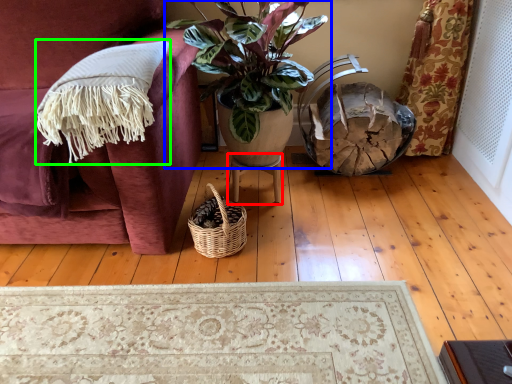
Question: Which is nearer to the table (highlighted by a red box)? houseplant (highlighted by a blue box) or blanket (highlighted by a green box).

Choices:
 (A) houseplant
 (B) blanket

Answer: (A)